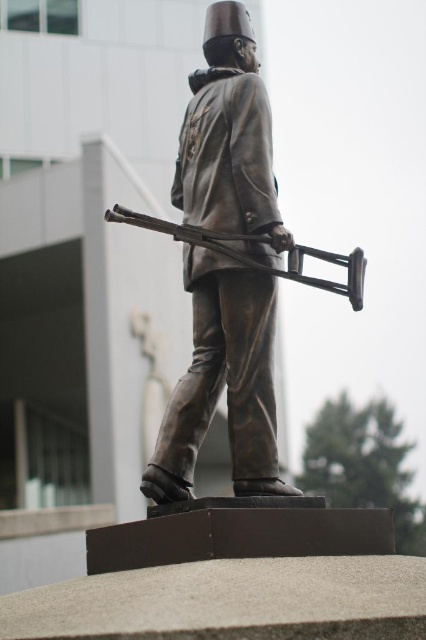
Looking at this image, you are an art conservator assessing the bronze statue at center and the bronze rifle at center. Which object has a smaller width when viewed from the front?

The bronze statue at center is thinner than the bronze rifle at center, so the bronze statue at center has a smaller width when viewed from the front.

You are a city planner assessing the statue and rifle placement for accessibility. Given that the minimum required clearance between objects in public spaces is 20 inches for wheelchair access, can the bronze statue at center and bronze rifle at center be moved closer together to meet this requirement?

The bronze statue at center and bronze rifle at center are currently 19.17 inches apart, which is less than the required 20 inches for wheelchair access. To meet the requirement, they need to be moved slightly further apart, not closer.

You are an art student analyzing the statue and its components. Based on the scene, which object occupies a more prominent position in terms of size between the bronze statue at center and the bronze rifle at center?

The bronze statue at center is larger in size compared to the bronze rifle at center, so it occupies a more prominent position.